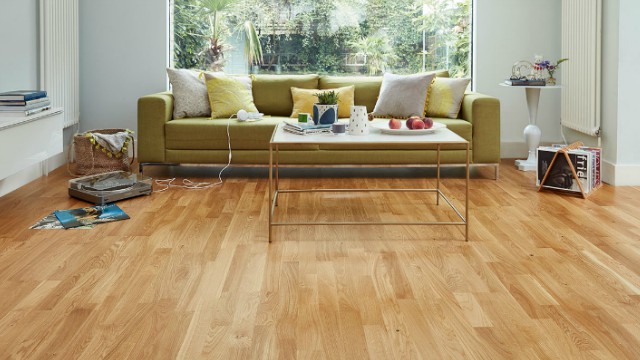
Identify the location of coffee table. (365, 140).